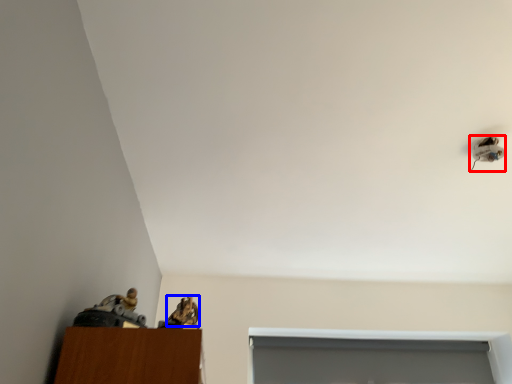
Question: Among these objects, which one is farthest to the camera, lamp (highlighted by a red box) or animal (highlighted by a blue box)?

Choices:
 (A) lamp
 (B) animal

Answer: (A)